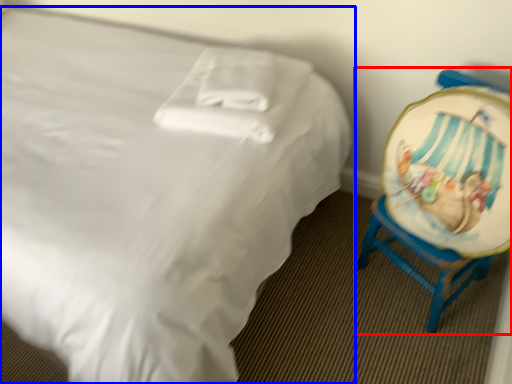
Question: Which object appears farthest to the camera in this image, chair (highlighted by a red box) or bed (highlighted by a blue box)?

Choices:
 (A) chair
 (B) bed

Answer: (A)